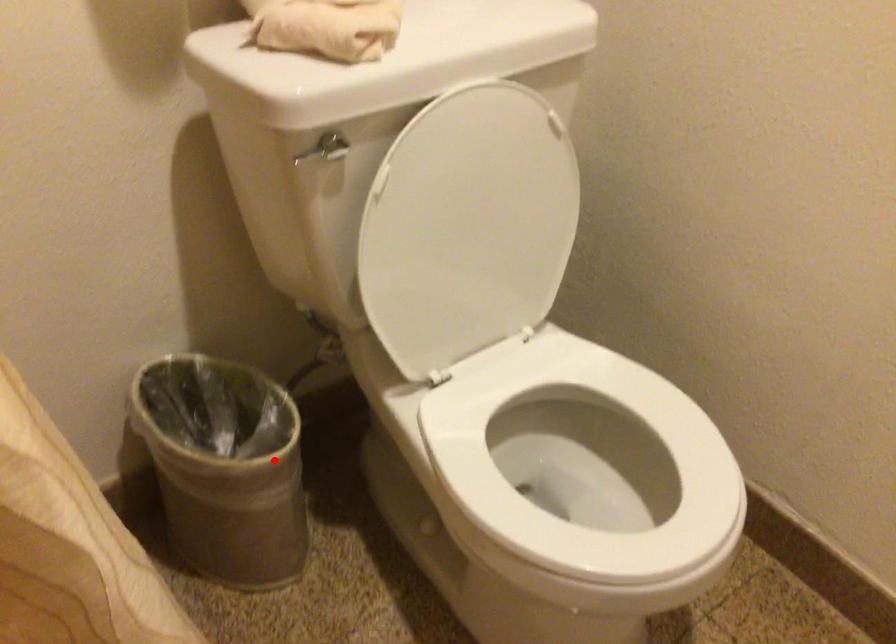
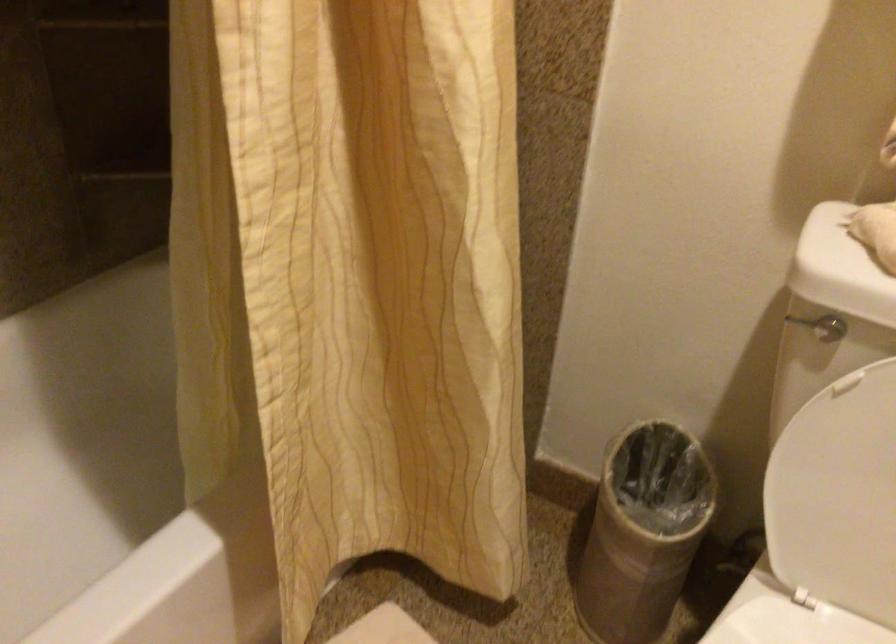
Find the pixel in the second image that matches the highlighted location in the first image.

(643, 532)